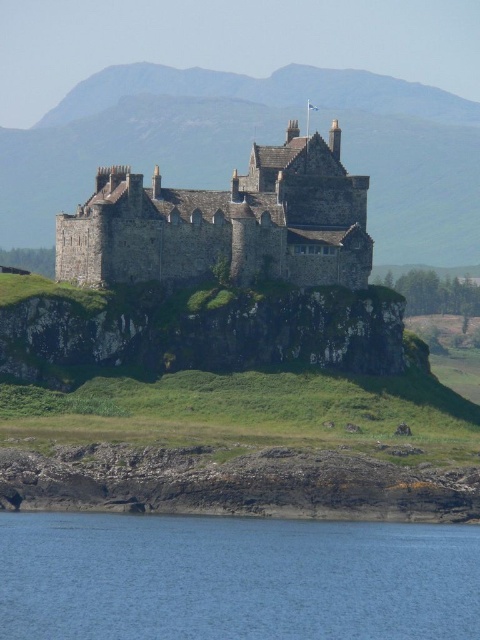
Question: Does blue water at lower left have a smaller size compared to stone medieval castle at center?

Choices:
 (A) no
 (B) yes

Answer: (B)

Question: Which of the following is the closest to the observer?

Choices:
 (A) (56, 236)
 (B) (287, 84)
 (C) (223, 560)

Answer: (C)

Question: Which of the following is the farthest from the observer?

Choices:
 (A) (396, 529)
 (B) (364, 253)

Answer: (B)

Question: In this image, where is brown stone castle at center located relative to stone medieval castle at center?

Choices:
 (A) right
 (B) left

Answer: (A)

Question: Is blue water at lower left wider than brown stone castle at center?

Choices:
 (A) no
 (B) yes

Answer: (A)

Question: Which object is the farthest from the brown stone castle at center?

Choices:
 (A) stone medieval castle at center
 (B) blue water at lower left

Answer: (B)